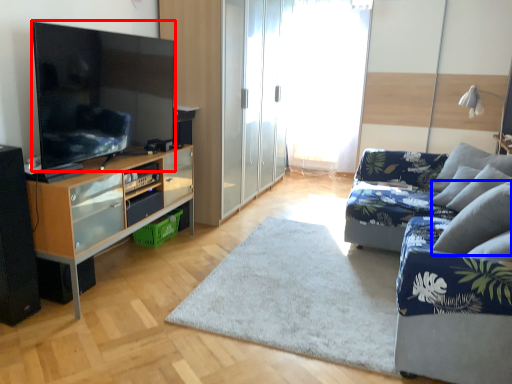
Question: Which object is further to the camera taking this photo, television (highlighted by a red box) or pillow (highlighted by a blue box)?

Choices:
 (A) television
 (B) pillow

Answer: (B)